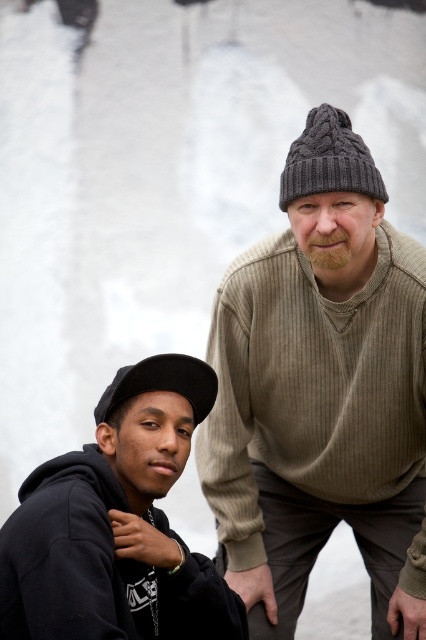
Question: Which point is closer to the camera?

Choices:
 (A) black fabric cap at lower left
 (B) dark gray knitted beanie at upper right

Answer: (A)

Question: Does knitted gray beanie at upper right appear under dark gray knitted beanie at upper right?

Choices:
 (A) no
 (B) yes

Answer: (B)

Question: Which point is closer to the camera?

Choices:
 (A) dark gray knitted beanie at upper right
 (B) black fabric cap at lower left
 (C) black matte hoodie at lower left
 (D) knitted gray beanie at upper right

Answer: (C)

Question: Does dark gray knitted beanie at upper right have a lesser width compared to black fabric cap at lower left?

Choices:
 (A) no
 (B) yes

Answer: (B)

Question: Can you confirm if knitted gray beanie at upper right is smaller than black fabric cap at lower left?

Choices:
 (A) yes
 (B) no

Answer: (B)

Question: Among these objects, which one is nearest to the camera?

Choices:
 (A) black fabric cap at lower left
 (B) black matte hoodie at lower left

Answer: (B)